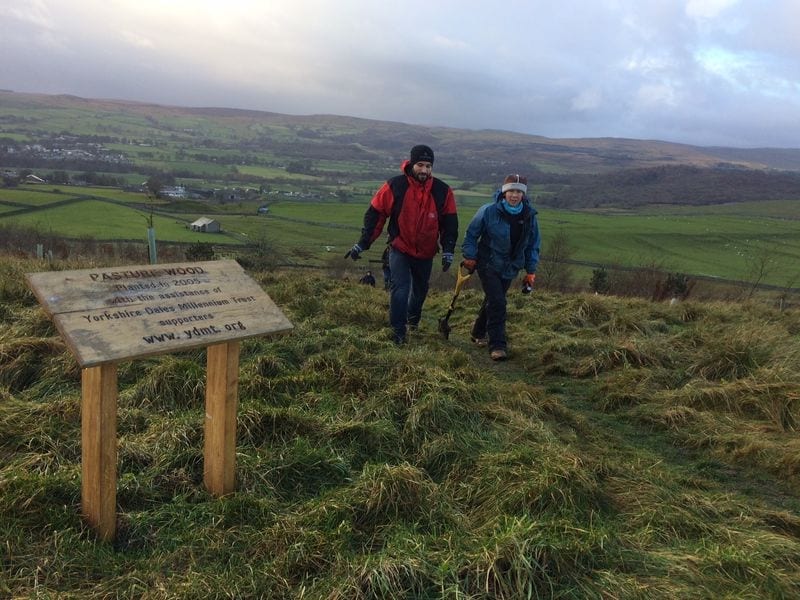
You are a GUI agent. You are given a task and a screenshot of the screen. Output one action in this format:
    pyautogui.click(x=<x>, y=<y>)
    Task: Click on the plaque
    
    Given the screenshot: What is the action you would take?
    pyautogui.click(x=166, y=335)